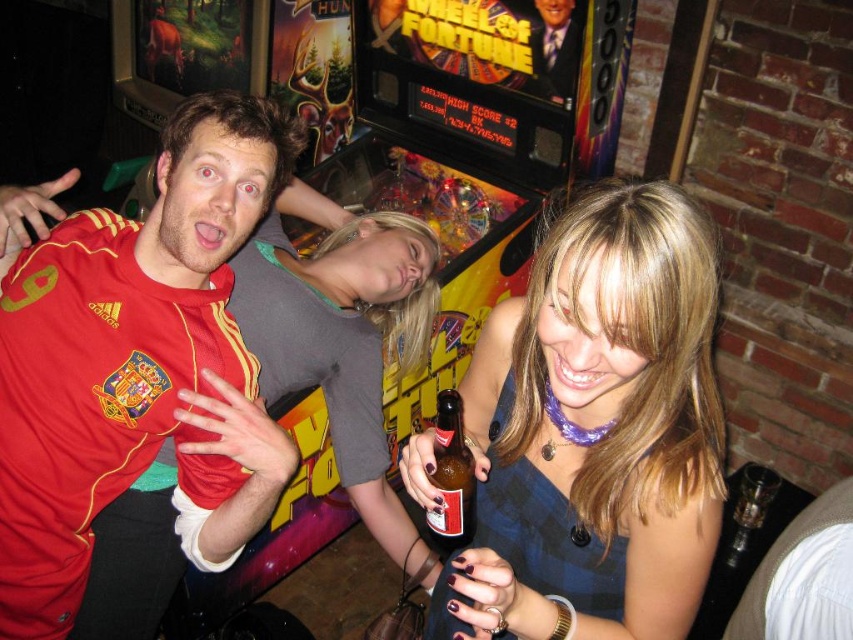
You are a photographer standing at the back of the bar. You want to take a photo of the matte blue dress at center and the matte jersey at left. The minimum distance required for your camera to focus on both subjects clearly is 20 inches. Can you capture both subjects in focus without moving closer?

The matte blue dress at center and matte jersey at left are 21.18 inches apart, which exceeds the camera minimum focus distance of 20 inches. Therefore, you can capture both subjects in focus without moving closer.

You are a bartender at the bar. You need to place a new drink order for the customer wearing the matte blue dress at center. Where should you place the drink in relation to the brown glass bottle at center?

The matte blue dress at center is located below the brown glass bottle at center, so the bartender should place the new drink order above the brown glass bottle at center to ensure it is above the customer wearing the matte blue dress at center.

You are a bartender in this bar scene. You need to place a new order of coasters next to the brown glass bottle at center. However, there is a matte blue dress at center in the way. Can you move the dress to make space for the coasters?

The matte blue dress at center is bigger than the brown glass bottle at center, so moving the dress might require more effort due to its larger size. However, since the coasters need to be placed next to the bottle, you should carefully move the dress aside to create space without disturbing the bottle.